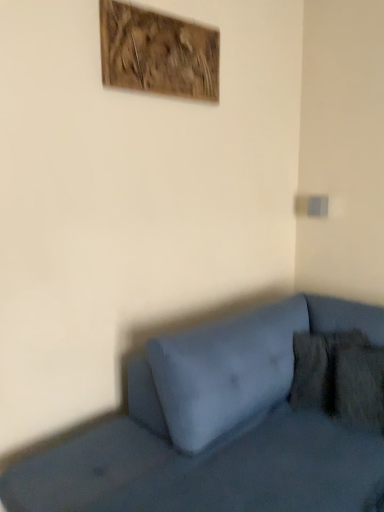
Question: From the image's perspective, is matte blue couch at lower right above or below velvety brown pillow at lower right?

Choices:
 (A) below
 (B) above

Answer: (A)

Question: Is matte blue couch at lower right to the left or to the right of velvety brown pillow at lower right in the image?

Choices:
 (A) right
 (B) left

Answer: (B)

Question: Based on their relative distances, which object is nearer to the matte blue couch at lower right?

Choices:
 (A) wooden textured artwork at upper center
 (B) velvety brown pillow at lower right

Answer: (B)

Question: Estimate the real-world distances between objects in this image. Which object is closer to the velvety brown pillow at lower right?

Choices:
 (A) wooden textured artwork at upper center
 (B) matte blue couch at lower right

Answer: (B)